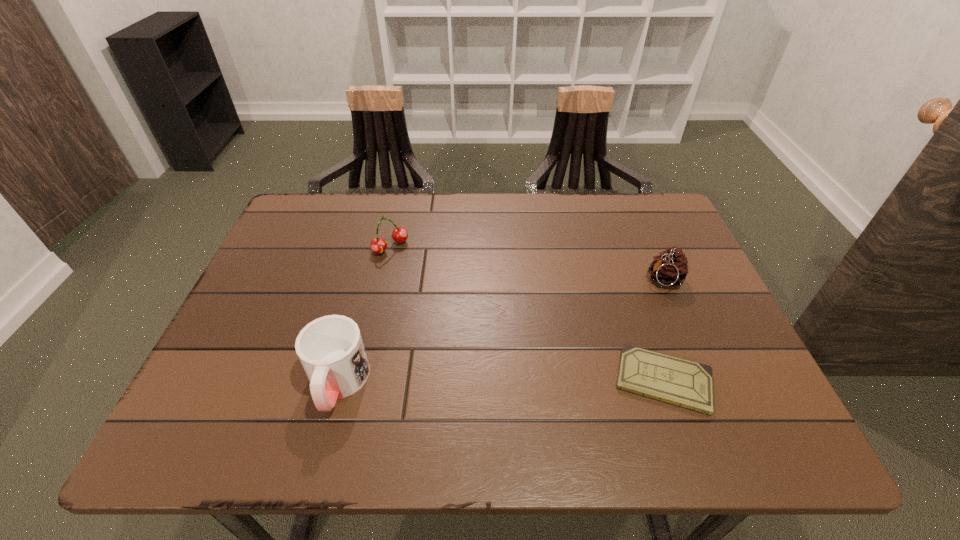
This screenshot has height=540, width=960. In order to click on vacant point at the far left corner in this screenshot , I will do `click(294, 238)`.

Find the location of `vacant space at the near left corner`. vacant space at the near left corner is located at coordinates (223, 380).

At what (x,y) coordinates should I click in order to perform the action: click on vacant space at the far right corner of the desktop. Please return your answer as a coordinate pair (x, y). Image resolution: width=960 pixels, height=540 pixels. Looking at the image, I should click on (684, 240).

I want to click on vacant area that lies between the checkbook and the cherry, so click(527, 313).

The image size is (960, 540). What are the coordinates of `vacant space in between the shortest object and the second farthest object` in the screenshot? It's located at (664, 330).

Identify the location of free spot between the cherry and the mug. (365, 315).

Locate an element on the screen. free area in between the checkbook and the pinecone is located at coordinates (664, 330).

You are a GUI agent. You are given a task and a screenshot of the screen. Output one action in this format:
    pyautogui.click(x=<x>, y=<y>)
    Task: Click on the free space between the mug and the cherry
    The height and width of the screenshot is (540, 960).
    Given the screenshot: What is the action you would take?
    pyautogui.click(x=365, y=315)

The height and width of the screenshot is (540, 960). Find the location of `free spot between the shortest object and the mug`. free spot between the shortest object and the mug is located at coordinates (501, 382).

Locate an element on the screen. This screenshot has width=960, height=540. empty location between the mug and the farthest object is located at coordinates (365, 315).